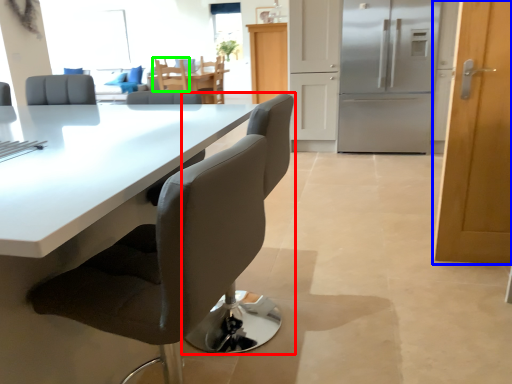
Question: Estimate the real-world distances between objects in this image. Which object is closer to chair (highlighted by a red box), door (highlighted by a blue box) or chair (highlighted by a green box)?

Choices:
 (A) door
 (B) chair

Answer: (A)